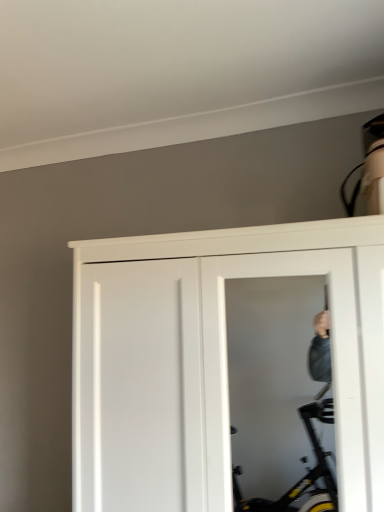
Measure the distance between white matte door at center and camera.

The distance of white matte door at center from camera is 36.50 inches.

Locate an element on the screen. white matte door at center is located at coordinates (213, 359).

Describe the element at coordinates (213, 359) in the screenshot. I see `white matte door at center` at that location.

This screenshot has width=384, height=512. What are the coordinates of `transparent plastic screen door at center` in the screenshot? It's located at [332, 360].

Describe the element at coordinates (332, 360) in the screenshot. Image resolution: width=384 pixels, height=512 pixels. I see `transparent plastic screen door at center` at that location.

You are a GUI agent. You are given a task and a screenshot of the screen. Output one action in this format:
    pyautogui.click(x=<x>, y=<y>)
    Task: Click on the white matte door at center
    The image size is (384, 512).
    Given the screenshot: What is the action you would take?
    pyautogui.click(x=213, y=359)

Which is more to the right, transparent plastic screen door at center or white matte door at center?

transparent plastic screen door at center is more to the right.

Considering the positions of objects transparent plastic screen door at center and white matte door at center in the image provided, who is in front, transparent plastic screen door at center or white matte door at center?

white matte door at center.

Which point is more distant from viewer, [270,274] or [328,226]?

Positioned behind is point [270,274].

From the image's perspective, is transparent plastic screen door at center above or below white matte door at center?

Clearly, from the image's perspective, transparent plastic screen door at center is above white matte door at center.

From a real-world perspective, between transparent plastic screen door at center and white matte door at center, who is vertically lower?

In real-world perspective, white matte door at center is lower.

Looking at their sizes, would you say transparent plastic screen door at center is wider or thinner than white matte door at center?

transparent plastic screen door at center is thinner than white matte door at center.

Is transparent plastic screen door at center taller than white matte door at center?

No, transparent plastic screen door at center is not taller than white matte door at center.

Who is bigger, transparent plastic screen door at center or white matte door at center?

white matte door at center.

Is transparent plastic screen door at center not inside white matte door at center?

Actually, transparent plastic screen door at center is within white matte door at center.

Is transparent plastic screen door at center beside white matte door at center?

transparent plastic screen door at center is not next to white matte door at center, and they're not touching.

Consider the image. Is transparent plastic screen door at center aimed at white matte door at center?

Yes, transparent plastic screen door at center is aimed at white matte door at center.

Identify the location of screen door above the white matte door at center (from a real-world perspective). The image size is (384, 512). coord(332,360).

Which object is positioned more to the left, white matte door at center or transparent plastic screen door at center?

Positioned to the left is white matte door at center.

Considering the positions of objects white matte door at center and transparent plastic screen door at center in the image provided, who is in front, white matte door at center or transparent plastic screen door at center?

white matte door at center is closer to the camera.

Considering the points (124, 508) and (318, 257), which point is behind, point (124, 508) or point (318, 257)?

The point (124, 508) is farther from the camera.

Based on the photo, from the image's perspective, which is above, white matte door at center or transparent plastic screen door at center?

From the image's view, transparent plastic screen door at center is above.

From a real-world perspective, who is located higher, white matte door at center or transparent plastic screen door at center?

transparent plastic screen door at center.

Can you confirm if white matte door at center is wider than transparent plastic screen door at center?

Indeed, white matte door at center has a greater width compared to transparent plastic screen door at center.

Who is shorter, white matte door at center or transparent plastic screen door at center?

Standing shorter between the two is transparent plastic screen door at center.

Considering the sizes of white matte door at center and transparent plastic screen door at center in the image, is white matte door at center bigger or smaller than transparent plastic screen door at center?

In the image, white matte door at center appears to be larger than transparent plastic screen door at center.

Is white matte door at center not within transparent plastic screen door at center?

white matte door at center is positioned outside transparent plastic screen door at center.

Can you see white matte door at center touching transparent plastic screen door at center?

No, white matte door at center is not in contact with transparent plastic screen door at center.

Is white matte door at center facing away from transparent plastic screen door at center?

That's right, white matte door at center is facing away from transparent plastic screen door at center.

How many degrees apart are the facing directions of white matte door at center and transparent plastic screen door at center?

The angle between the facing direction of white matte door at center and the facing direction of transparent plastic screen door at center is 0.268 degrees.

Where is `door on the left of transparent plastic screen door at center`? door on the left of transparent plastic screen door at center is located at coordinates (213, 359).

Where is `door that appears on the left of transparent plastic screen door at center`? The image size is (384, 512). door that appears on the left of transparent plastic screen door at center is located at coordinates (213, 359).

You are a GUI agent. You are given a task and a screenshot of the screen. Output one action in this format:
    pyautogui.click(x=<x>, y=<y>)
    Task: Click on the screen door above the white matte door at center (from a real-world perspective)
    The image size is (384, 512).
    Given the screenshot: What is the action you would take?
    pyautogui.click(x=332, y=360)